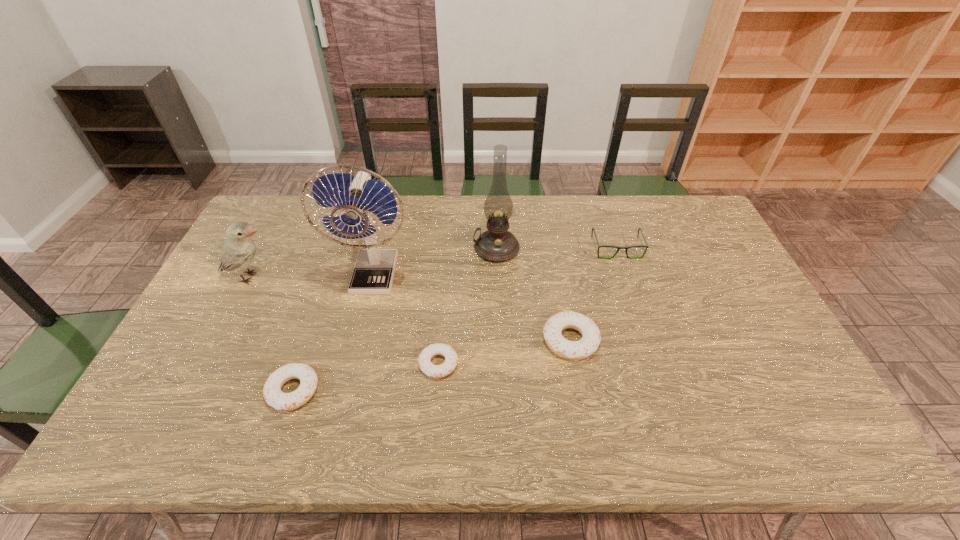
You are a GUI agent. You are given a task and a screenshot of the screen. Output one action in this format:
    pyautogui.click(x=<x>, y=<y>)
    Task: Click on the doughnut that is the closest to the shortest doughnut
    
    Given the screenshot: What is the action you would take?
    pyautogui.click(x=574, y=350)

The image size is (960, 540). I want to click on vacant space that satisfies the following two spatial constraints: 1. at the face of the leftmost doughnut; 2. on the right side of the bird, so click(192, 390).

Locate an element on the screen. vacant space that satisfies the following two spatial constraints: 1. on the back side of the second doughnut from left to right; 2. on the left side of the rightmost doughnut is located at coordinates (441, 340).

Locate an element on the screen. This screenshot has width=960, height=540. free spot that satisfies the following two spatial constraints: 1. on the back side of the second shortest doughnut; 2. on the right side of the oil lamp is located at coordinates (342, 248).

Locate an element on the screen. blank area in the image that satisfies the following two spatial constraints: 1. on the back side of the shortest doughnut; 2. on the right side of the fifth object from left to right is located at coordinates (447, 248).

Identify the location of free spot that satisfies the following two spatial constraints: 1. on the back side of the second shortest doughnut; 2. at the face of the leftmost object. The image size is (960, 540). (331, 277).